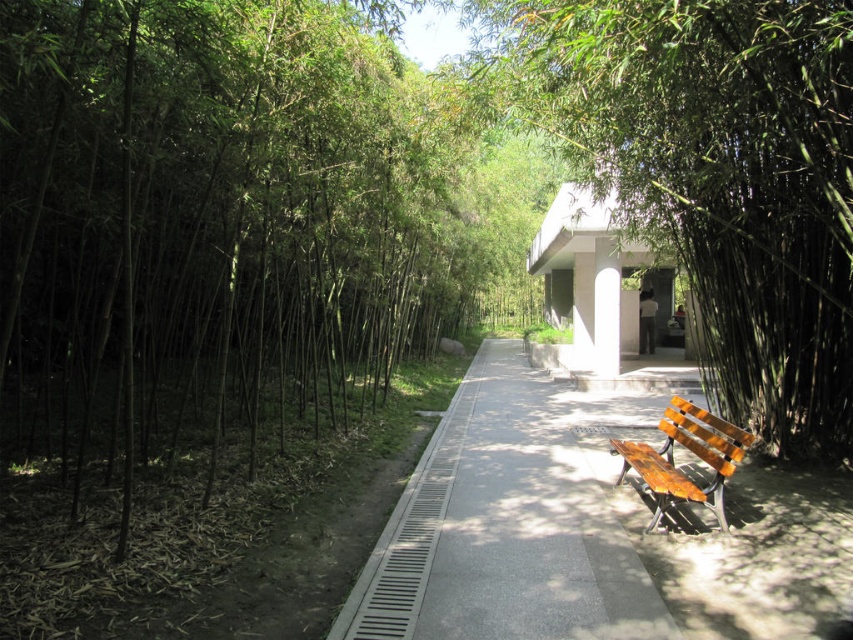
You are standing at the wooden bench on the right side of the pathway. Looking straight ahead, you see a point marked at coordinates (589, 531) on the path. What type of surface does this point represent?

The point at coordinates (589, 531) marks smooth concrete pavement at center.

You are standing at the entrance of the bamboo pathway and want to sit on the green matte bench at center. Based on the coordinates provided, is the bench positioned to your left or right side of the path?

The green matte bench at center is located at point (712,173), which places it on the right side of the path according to the coordinates given.